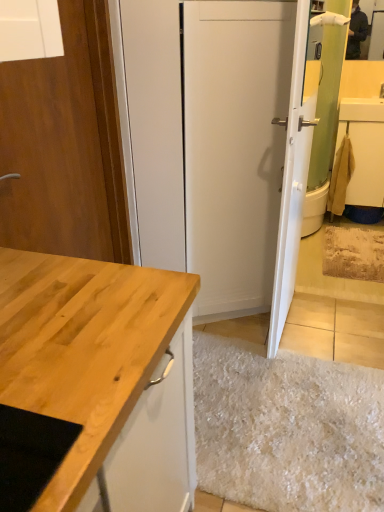
Question: Can you confirm if white glossy door at upper right, the 2th door when ordered from left to right, is wider than beige fabric towel at right?

Choices:
 (A) no
 (B) yes

Answer: (A)

Question: Is white glossy door at upper right, the 2th door when ordered from left to right, not inside beige fabric towel at right?

Choices:
 (A) yes
 (B) no

Answer: (A)

Question: Does white glossy door at upper right, which appears as the 1th door when viewed from the right, have a lesser width compared to beige fabric towel at right?

Choices:
 (A) yes
 (B) no

Answer: (A)

Question: Could beige fabric towel at right be considered to be inside white glossy door at upper right, the 2th door when ordered from left to right?

Choices:
 (A) yes
 (B) no

Answer: (B)

Question: Can you confirm if white glossy door at upper right, which appears as the 1th door when viewed from the right, is bigger than beige fabric towel at right?

Choices:
 (A) yes
 (B) no

Answer: (A)

Question: Does white glossy door at upper right, which appears as the 1th door when viewed from the right, appear on the left side of beige fabric towel at right?

Choices:
 (A) no
 (B) yes

Answer: (B)

Question: Is white glossy door at upper right, the 2th door when ordered from left to right, smaller than wooden door at left, which is the second door from right to left?

Choices:
 (A) no
 (B) yes

Answer: (A)

Question: Considering the relative positions of white glossy door at upper right, which appears as the 1th door when viewed from the right, and wooden door at left, which is the second door from right to left, in the image provided, is white glossy door at upper right, which appears as the 1th door when viewed from the right, in front of wooden door at left, which is the second door from right to left,?

Choices:
 (A) yes
 (B) no

Answer: (B)

Question: Considering the relative positions of white glossy door at upper right, which appears as the 1th door when viewed from the right, and wooden door at left, which is the second door from right to left, in the image provided, is white glossy door at upper right, which appears as the 1th door when viewed from the right, to the left of wooden door at left, which is the second door from right to left, from the viewer's perspective?

Choices:
 (A) no
 (B) yes

Answer: (A)

Question: Is wooden door at left, which is the second door from right to left, at the back of white glossy door at upper right, the 2th door when ordered from left to right?

Choices:
 (A) yes
 (B) no

Answer: (B)

Question: Can you confirm if white glossy door at upper right, the 2th door when ordered from left to right, is shorter than wooden door at left, acting as the first door starting from the left?

Choices:
 (A) no
 (B) yes

Answer: (A)

Question: From the image's perspective, is white glossy door at upper right, which appears as the 1th door when viewed from the right, above wooden door at left, acting as the first door starting from the left?

Choices:
 (A) no
 (B) yes

Answer: (B)

Question: Can wooden door at left, which is the second door from right to left, be found inside beige fabric towel at right?

Choices:
 (A) yes
 (B) no

Answer: (B)